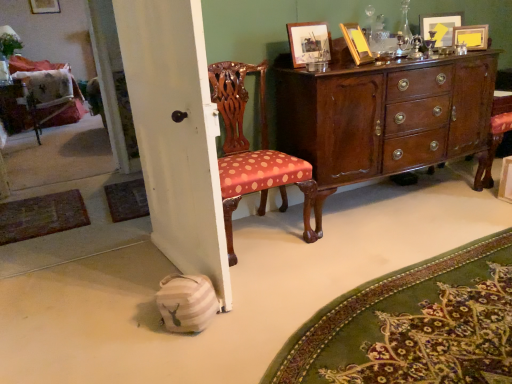
Where is `vacant region to the left of woven brown mat at lower left, which is the third mat from front to back`? The width and height of the screenshot is (512, 384). vacant region to the left of woven brown mat at lower left, which is the third mat from front to back is located at coordinates (67, 202).